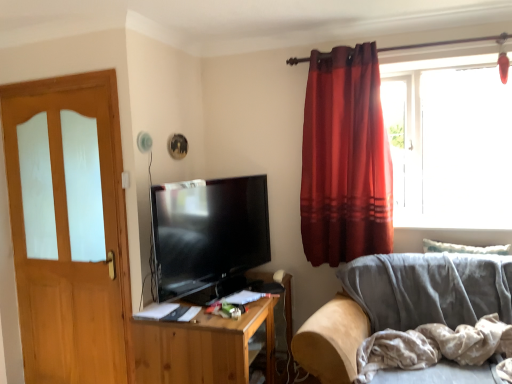
I want to click on matte black tv at center, so click(208, 233).

What do you see at coordinates (345, 159) in the screenshot? This screenshot has height=384, width=512. I see `velvet red curtain at right` at bounding box center [345, 159].

In order to face light brown wood door at left, should I rotate leftwards or rightwards?

Turn left by 24.184 degrees to look at light brown wood door at left.

Locate an element on the screen. This screenshot has height=384, width=512. wooden tv stand at center is located at coordinates (203, 348).

The image size is (512, 384). I want to click on velvet gray couch at lower right, so click(x=400, y=304).

From the image's perspective, is light gray cotton blanket at lower right located above transparent glass window at upper right?

Actually, light gray cotton blanket at lower right appears below transparent glass window at upper right in the image.

Can you confirm if light gray cotton blanket at lower right is positioned to the left of transparent glass window at upper right?

Correct, you'll find light gray cotton blanket at lower right to the left of transparent glass window at upper right.

Could you measure the distance between light gray cotton blanket at lower right and transparent glass window at upper right?

They are 3.40 feet apart.

How different are the orientations of light gray cotton blanket at lower right and transparent glass window at upper right in degrees?

The angular difference between light gray cotton blanket at lower right and transparent glass window at upper right is 2.11 degrees.

Do you think matte black tv at center is within velvet gray couch at lower right, or outside of it?

The correct answer is: outside.

Measure the distance between matte black tv at center and velvet gray couch at lower right.

matte black tv at center and velvet gray couch at lower right are 33.72 inches apart from each other.

Is matte black tv at center bigger than velvet gray couch at lower right?

Incorrect, matte black tv at center is not larger than velvet gray couch at lower right.

From the image's perspective, is matte black tv at center located above velvet gray couch at lower right?

Yes, from the image's perspective, matte black tv at center is over velvet gray couch at lower right.

Could you tell me if matte black tv at center is turned towards wooden tv stand at center?

No, matte black tv at center is not aimed at wooden tv stand at center.

Is point (177, 298) farther from camera compared to point (234, 369)?

Yes, it is.

From the image's perspective, which is above, matte black tv at center or wooden tv stand at center?

From the image's view, matte black tv at center is above.

Is matte black tv at center outside of wooden tv stand at center?

Yes, matte black tv at center is outside of wooden tv stand at center.

How many degrees apart are the facing directions of velvet red curtain at right and transparent glass window at upper right?

They differ by 0.247 degrees in their facing directions.

Can you see velvet red curtain at right touching transparent glass window at upper right?

No, velvet red curtain at right is not with transparent glass window at upper right.

Is point (361, 121) positioned in front of point (439, 136)?

Yes.

You are a GUI agent. You are given a task and a screenshot of the screen. Output one action in this format:
    pyautogui.click(x=<x>, y=<y>)
    Task: Click on the cabinetry behind the velvet gray couch at lower right
    The width and height of the screenshot is (512, 384).
    Given the screenshot: What is the action you would take?
    pyautogui.click(x=203, y=348)

Is velvet gray couch at lower right closer to the viewer compared to wooden tv stand at center?

Yes, velvet gray couch at lower right is closer to the viewer.

Does velvet gray couch at lower right touch wooden tv stand at center?

No, velvet gray couch at lower right is not next to wooden tv stand at center.

Is velvet red curtain at right facing towards matte black tv at center?

No, velvet red curtain at right is not aimed at matte black tv at center.

Does velvet red curtain at right have a greater height compared to matte black tv at center?

Correct, velvet red curtain at right is much taller as matte black tv at center.

Would you say velvet red curtain at right is a long distance from matte black tv at center?

No.

From a real-world perspective, who is located higher, velvet red curtain at right or matte black tv at center?

In real-world perspective, velvet red curtain at right is above.

Is light brown wood door at left wider than light gray cotton blanket at lower right?

In fact, light brown wood door at left might be narrower than light gray cotton blanket at lower right.

From the picture: Would you say light brown wood door at left is a long distance from light gray cotton blanket at lower right?

Yes, light brown wood door at left is far from light gray cotton blanket at lower right.

Would you say light brown wood door at left contains light gray cotton blanket at lower right?

Definitely not — light gray cotton blanket at lower right is not inside light brown wood door at left.

Does light brown wood door at left have a larger size compared to light gray cotton blanket at lower right?

Yes, light brown wood door at left is bigger than light gray cotton blanket at lower right.

The image size is (512, 384). Find the location of `bedding that is under the transparent glass window at upper right (from a real-world perspective)`. bedding that is under the transparent glass window at upper right (from a real-world perspective) is located at coordinates (433, 346).

Find the location of a particular element. The image size is (512, 384). studio couch located below the matte black tv at center (from the image's perspective) is located at coordinates (400, 304).

Looking at the image, which one is located further to light brown wood door at left, transparent glass window at upper right or velvet red curtain at right?

transparent glass window at upper right is further to light brown wood door at left.

Looking at the image, which one is located closer to wooden tv stand at center, matte black tv at center or velvet gray couch at lower right?

Based on the image, matte black tv at center appears to be nearer to wooden tv stand at center.

Looking at the image, which one is located further to light gray cotton blanket at lower right, light brown wood door at left or velvet red curtain at right?

light brown wood door at left lies further to light gray cotton blanket at lower right than the other object.

When comparing their distances from velvet gray couch at lower right, does wooden tv stand at center or transparent glass window at upper right seem closer?

The object closer to velvet gray couch at lower right is wooden tv stand at center.

Considering their positions, is matte black tv at center positioned closer to velvet gray couch at lower right than wooden tv stand at center?

Based on the image, wooden tv stand at center appears to be nearer to velvet gray couch at lower right.

Looking at the image, which one is located closer to wooden tv stand at center, velvet gray couch at lower right or light gray cotton blanket at lower right?

velvet gray couch at lower right is closer to wooden tv stand at center.

Based on their spatial positions, is velvet red curtain at right or velvet gray couch at lower right closer to matte black tv at center?

Based on the image, velvet red curtain at right appears to be nearer to matte black tv at center.

Based on their spatial positions, is light gray cotton blanket at lower right or velvet red curtain at right closer to transparent glass window at upper right?

velvet red curtain at right.

I want to click on television between light brown wood door at left and velvet red curtain at right from left to right, so click(x=208, y=233).

Locate an element on the screen. The height and width of the screenshot is (384, 512). cabinetry between light brown wood door at left and light gray cotton blanket at lower right in the horizontal direction is located at coordinates [203, 348].

Find the location of a particular element. curtain between transparent glass window at upper right and velvet gray couch at lower right in the up-down direction is located at coordinates (345, 159).

Identify the location of cabinetry between light brown wood door at left and velvet red curtain at right. The width and height of the screenshot is (512, 384). (203, 348).